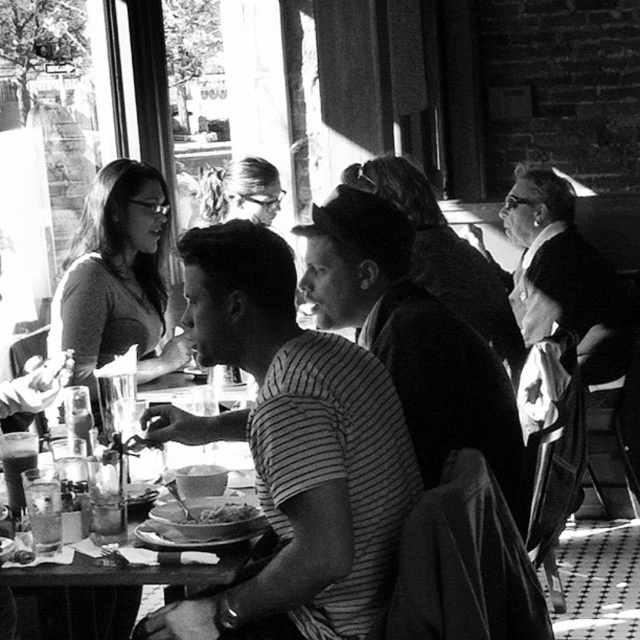
Does striped fabric shirt at center have a greater width compared to smooth brown bread at center?

Indeed, striped fabric shirt at center has a greater width compared to smooth brown bread at center.

Which is above, striped fabric shirt at center or smooth brown bread at center?

striped fabric shirt at center

Is point (272, 292) positioned in front of point (208, 499)?

Yes, point (272, 292) is in front of point (208, 499).

Locate an element on the screen. striped fabric shirt at center is located at coordinates (292, 448).

Is striped fabric shirt at center to the right of wooden table at center from the viewer's perspective?

Indeed, striped fabric shirt at center is positioned on the right side of wooden table at center.

Which is more to the right, striped fabric shirt at center or wooden table at center?

striped fabric shirt at center

Between point (296, 400) and point (125, 579), which one is positioned in front?

Point (296, 400)

Image resolution: width=640 pixels, height=640 pixels. In order to click on striped fabric shirt at center in this screenshot , I will do `click(292, 448)`.

Identify the location of striped fabric shirt at center. (292, 448).

Who is more forward, (x=154, y=438) or (x=104, y=168)?

Point (x=154, y=438)

Image resolution: width=640 pixels, height=640 pixels. In order to click on striped fabric shirt at center in this screenshot , I will do `click(292, 448)`.